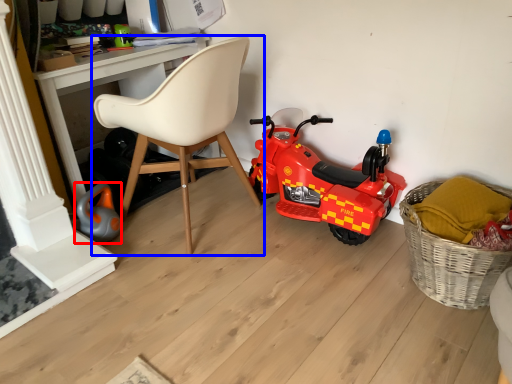
Question: Which of the following is the closest to the observer, toy (highlighted by a red box) or chair (highlighted by a blue box)?

Choices:
 (A) toy
 (B) chair

Answer: (B)